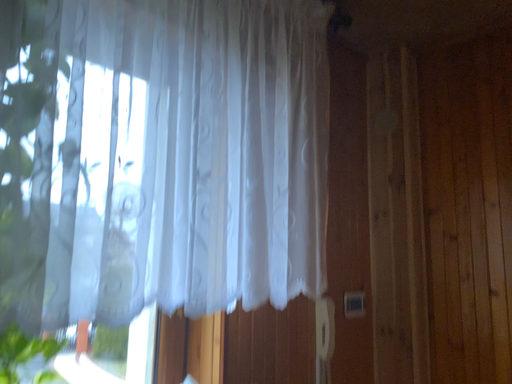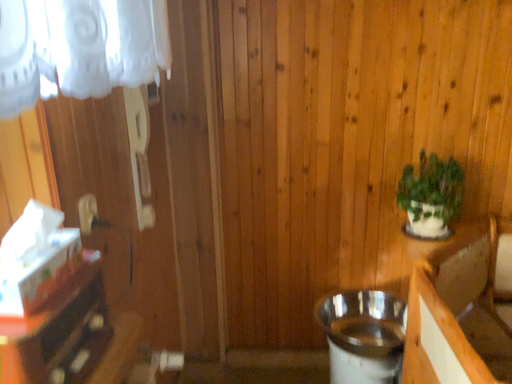
Question: How did the camera likely rotate when shooting the video?

Choices:
 (A) rotated downward
 (B) rotated upward

Answer: (A)